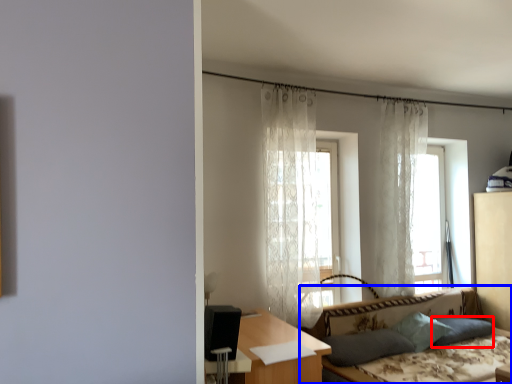
Question: Which point is closer to the camera, pillow (highlighted by a red box) or studio couch (highlighted by a blue box)?

Choices:
 (A) pillow
 (B) studio couch

Answer: (B)